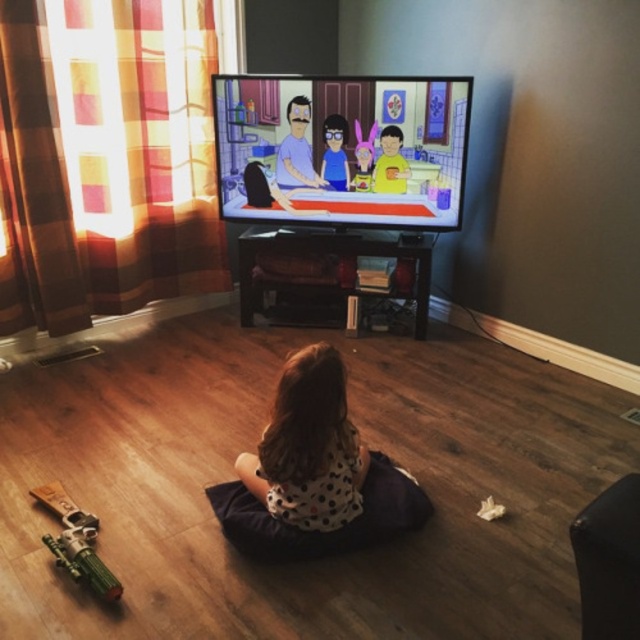
Who is more forward, (384, 502) or (58, 564)?

Point (58, 564) is in front.

Who is more forward, [330,541] or [68,544]?

Point [68,544] is more forward.

Identify the location of white dotted fabric at center. (320, 529).

Who is positioned more to the left, cartoon characters at upper center or polka dot fabric at center?

From the viewer's perspective, polka dot fabric at center appears more on the left side.

Measure the distance between cartoon characters at upper center and camera.

A distance of 10.02 feet exists between cartoon characters at upper center and camera.

Where is `cartoon characters at upper center`? cartoon characters at upper center is located at coordinates (342, 148).

Who is taller, polka dot fabric at center or white dotted fabric at center?

polka dot fabric at center is taller.

Based on the photo, can you confirm if polka dot fabric at center is positioned below white dotted fabric at center?

No, polka dot fabric at center is not below white dotted fabric at center.

Find the location of `polka dot fabric at center`. polka dot fabric at center is located at coordinates click(308, 445).